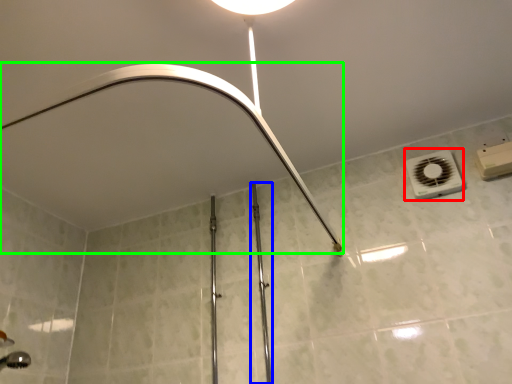
Question: Based on their relative distances, which object is farther from air conditioning (highlighted by a red box)? Choose from rail (highlighted by a blue box) and shower (highlighted by a green box).

Choices:
 (A) rail
 (B) shower

Answer: (A)